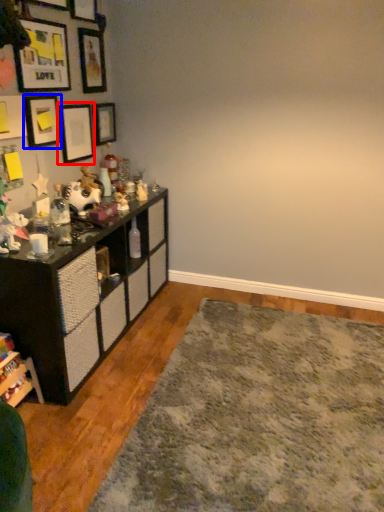
Question: Which point is further to the camera, picture frame (highlighted by a red box) or picture frame (highlighted by a blue box)?

Choices:
 (A) picture frame
 (B) picture frame

Answer: (A)